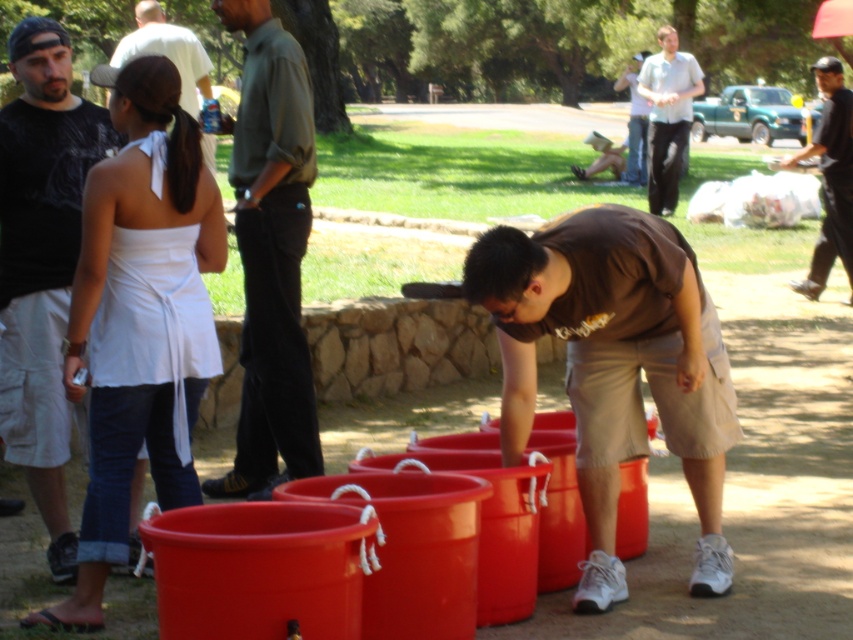
Question: Among these objects, which one is farthest from the camera?

Choices:
 (A) brown cotton shirt at center
 (B) black cotton shirt at upper right
 (C) light gray shirt at upper center
 (D) white fabric dress at upper left

Answer: (C)

Question: Does brown cotton shirt at center lie in front of matte white shirt at upper center?

Choices:
 (A) yes
 (B) no

Answer: (A)

Question: Which point is farther from the camera taking this photo?

Choices:
 (A) (134, 468)
 (B) (688, 100)

Answer: (B)

Question: Can you confirm if white fabric dress at left is smaller than white fabric dress at upper left?

Choices:
 (A) yes
 (B) no

Answer: (A)

Question: Which point is farther from the camera taking this photo?

Choices:
 (A) (62, 145)
 (B) (289, 81)

Answer: (B)

Question: Where is black cotton shirt at upper right located in relation to light gray shirt at upper center in the image?

Choices:
 (A) below
 (B) above

Answer: (A)